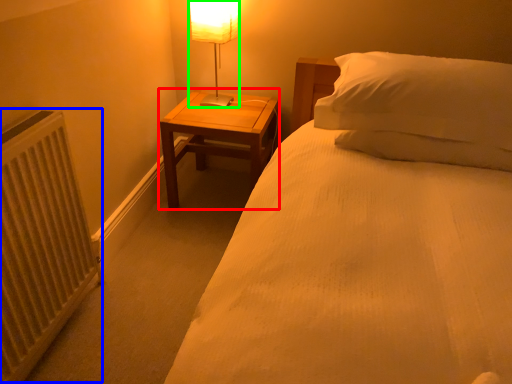
Question: Estimate the real-world distances between objects in this image. Which object is closer to nightstand (highlighted by a red box), radiator (highlighted by a blue box) or table lamp (highlighted by a green box)?

Choices:
 (A) radiator
 (B) table lamp

Answer: (B)